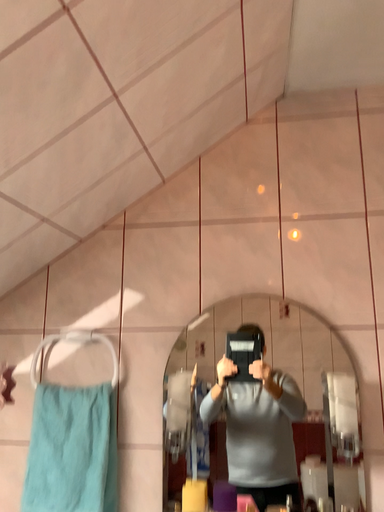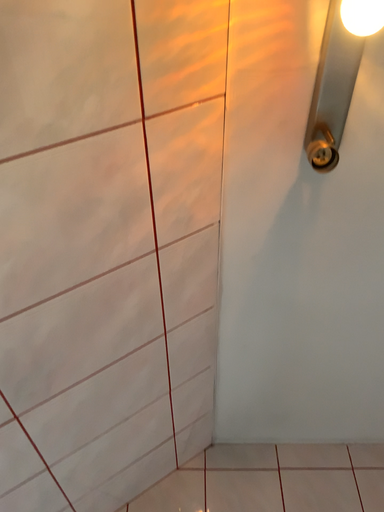
Question: How did the camera likely rotate when shooting the video?

Choices:
 (A) rotated upward
 (B) rotated downward

Answer: (A)